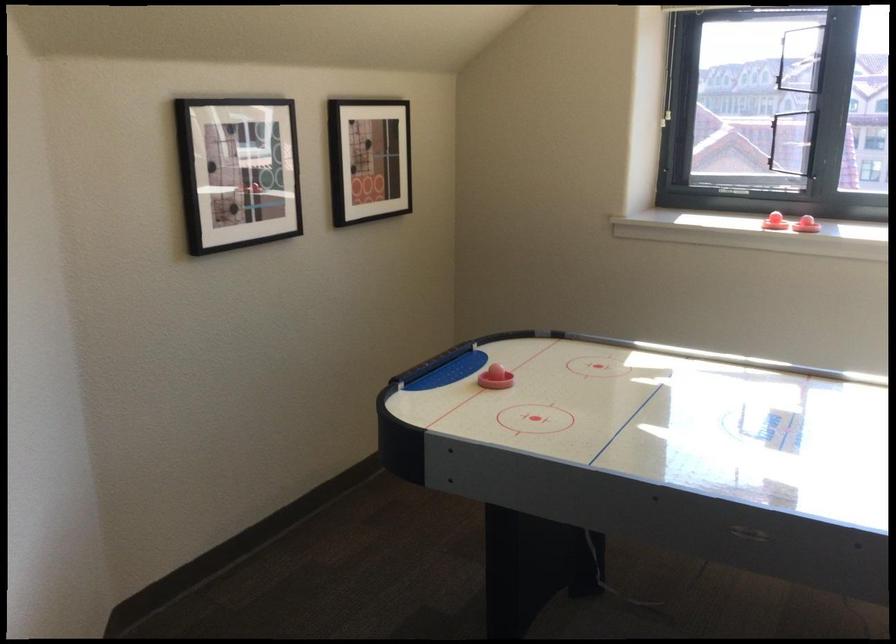
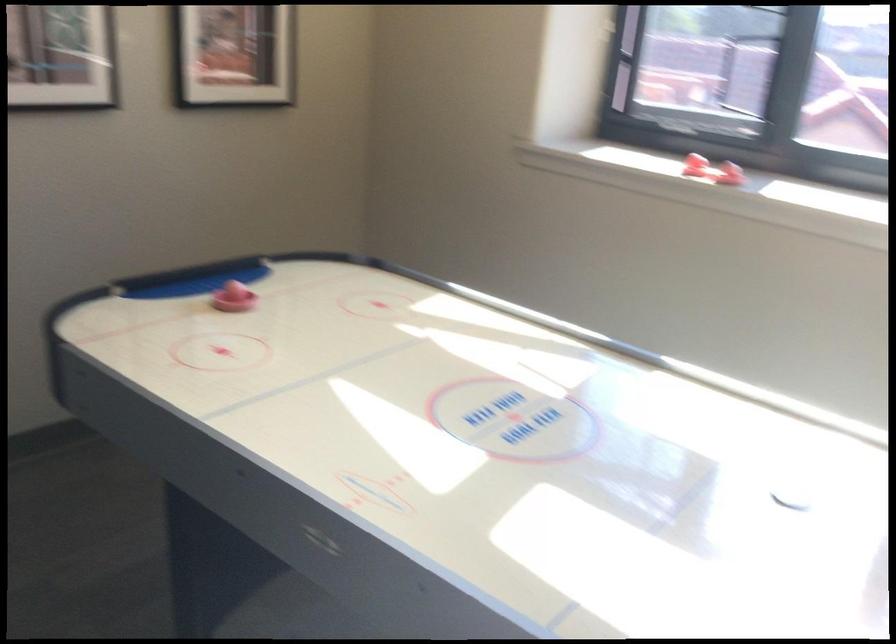
The images are taken continuously from a first-person perspective. In which direction are you moving?

The movement direction of the cameraman is right, forward.